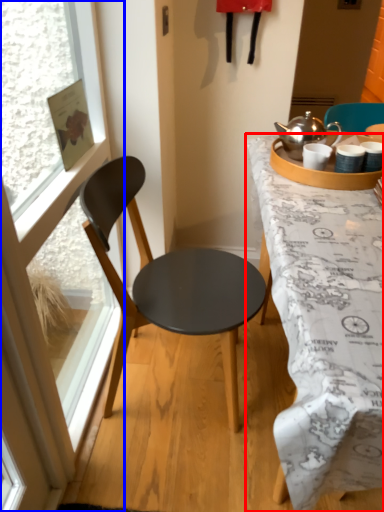
Question: Which point is further to the camera, desk (highlighted by a red box) or window (highlighted by a blue box)?

Choices:
 (A) desk
 (B) window

Answer: (A)